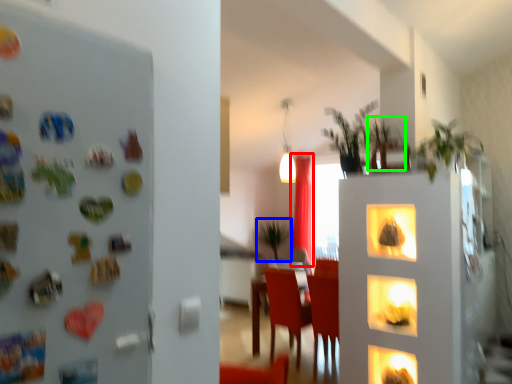
Question: Which is farther away from curtain (highlighted by a red box)? plant (highlighted by a blue box) or plant (highlighted by a green box)?

Choices:
 (A) plant
 (B) plant

Answer: (B)